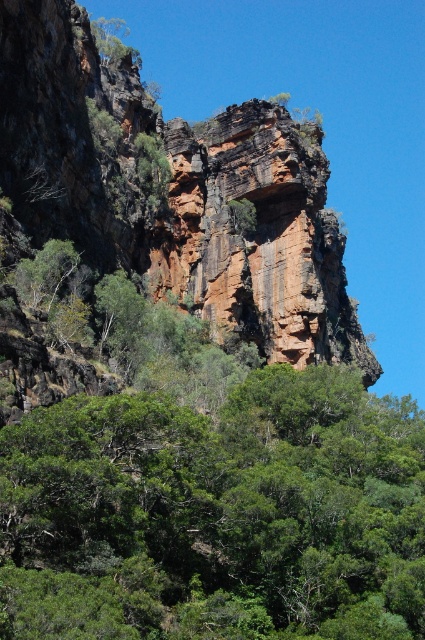
Question: Among these points, which one is nearest to the camera?

Choices:
 (A) (376, 509)
 (B) (96, 29)

Answer: (A)

Question: Is green leafy tree at center positioned before green leafy tree at upper left?

Choices:
 (A) yes
 (B) no

Answer: (A)

Question: Can you confirm if green leafy tree at center is positioned to the right of green leafy tree at upper left?

Choices:
 (A) yes
 (B) no

Answer: (A)

Question: Which of the following is the farthest from the observer?

Choices:
 (A) green leafy tree at center
 (B) green leafy tree at upper left

Answer: (B)

Question: Is green leafy tree at center positioned before green leafy tree at upper left?

Choices:
 (A) yes
 (B) no

Answer: (A)